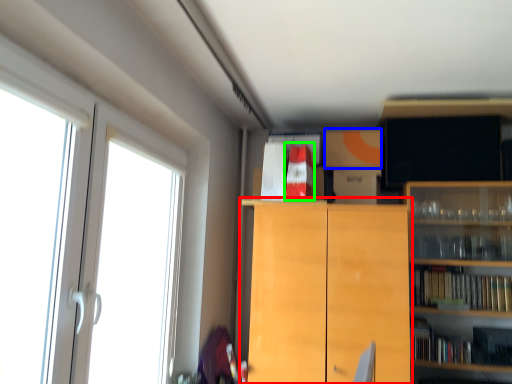
Question: Based on their relative distances, which object is nearer to cabinetry (highlighted by a red box)? Choose from cabinetry (highlighted by a blue box) and book (highlighted by a green box).

Choices:
 (A) cabinetry
 (B) book

Answer: (B)